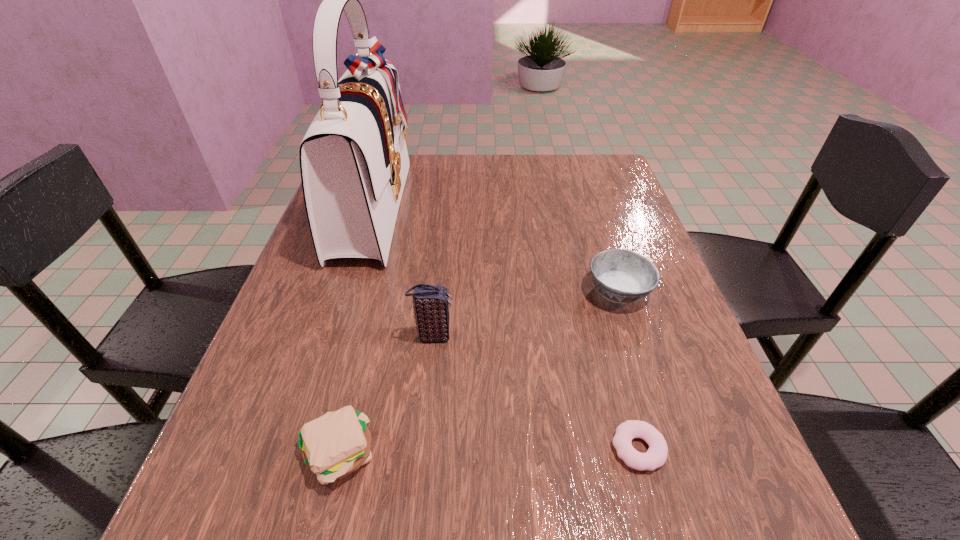
Where is `free space between the tallest object and the patty`? Image resolution: width=960 pixels, height=540 pixels. free space between the tallest object and the patty is located at coordinates (355, 331).

Identify the location of vacant space in between the patty and the satchel. (355, 331).

Identify the location of free space between the patty and the doughnut. (488, 451).

You are a GUI agent. You are given a task and a screenshot of the screen. Output one action in this format:
    pyautogui.click(x=<x>, y=<y>)
    Task: Click on the empty space that is in between the ashtray and the satchel
    
    Given the screenshot: What is the action you would take?
    pyautogui.click(x=495, y=249)

Locate an element on the screen. The height and width of the screenshot is (540, 960). object that stands as the second closest to the satchel is located at coordinates (333, 446).

Find the location of a particular element. The width and height of the screenshot is (960, 540). object that ranks as the fourth closest to the tallest object is located at coordinates (656, 455).

Where is `free spot that satisfies the following two spatial constraints: 1. on the front-facing side of the satchel; 2. on the back side of the ashtray`? free spot that satisfies the following two spatial constraints: 1. on the front-facing side of the satchel; 2. on the back side of the ashtray is located at coordinates (347, 292).

At what (x,y) coordinates should I click in order to perform the action: click on free location that satisfies the following two spatial constraints: 1. with the zip open on the shortest object; 2. on the right side of the third farthest object. Please return your answer as a coordinate pair (x, y). The image size is (960, 540). Looking at the image, I should click on (421, 448).

Find the location of a particular element. The height and width of the screenshot is (540, 960). vacant region that satisfies the following two spatial constraints: 1. on the front-facing side of the ashtray; 2. on the right side of the tallest object is located at coordinates (347, 292).

This screenshot has height=540, width=960. I want to click on vacant region that satisfies the following two spatial constraints: 1. on the front-facing side of the patty; 2. on the left side of the satchel, so click(x=296, y=454).